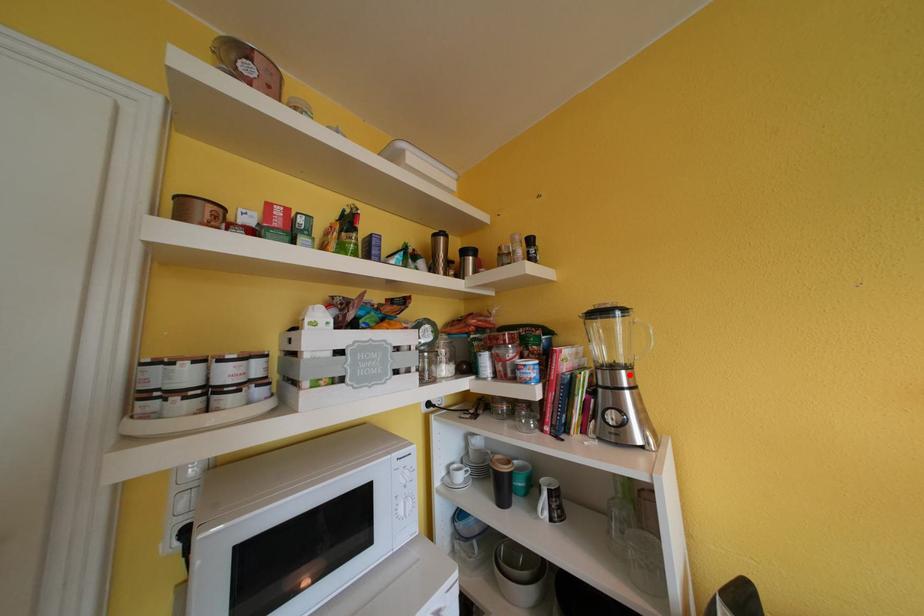
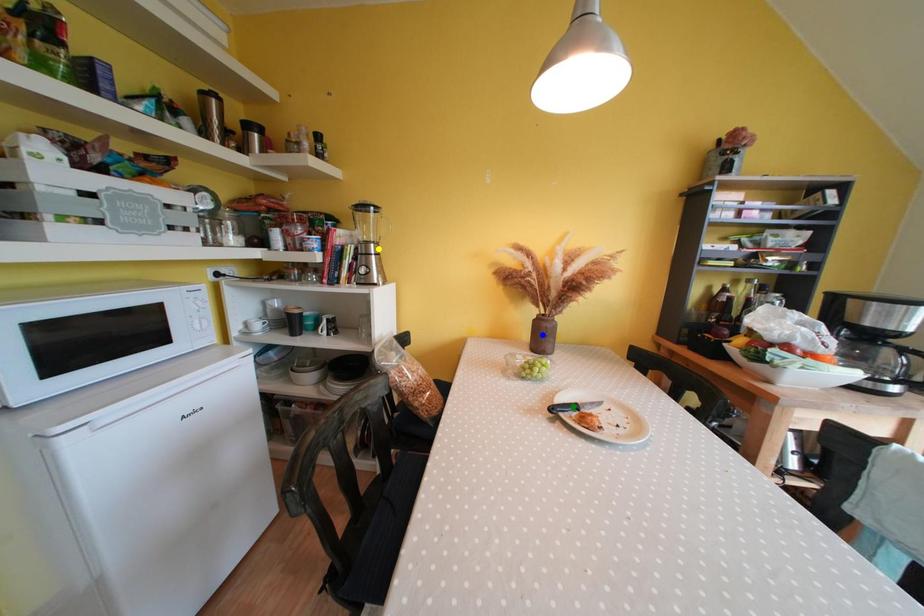
Question: I am providing you with two images of the same scene from different viewpoints. A red point is marked on the first image. You are given multiple points on the second image. Can you choose the point in image 2 that corresponds to the point in image 1?

Choices:
 (A) green point
 (B) yellow point
 (C) blue point

Answer: (B)